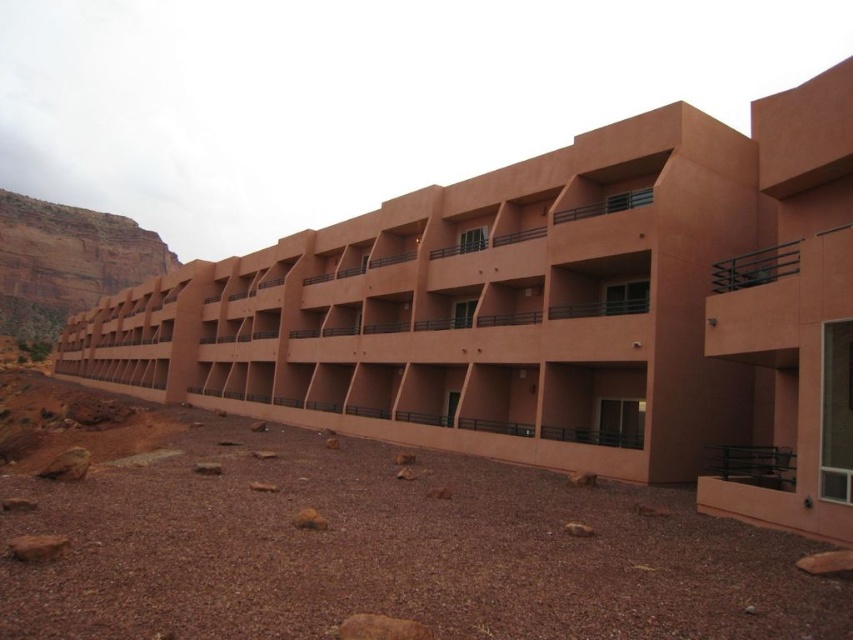
Question: Does matte orange building at center appear under rustic stone cliff at left?

Choices:
 (A) no
 (B) yes

Answer: (B)

Question: In this image, where is matte orange building at center located relative to rustic stone cliff at left?

Choices:
 (A) below
 (B) above

Answer: (A)

Question: Which point is closer to the camera?

Choices:
 (A) rustic stone cliff at left
 (B) matte orange building at center

Answer: (B)

Question: Can you confirm if matte orange building at center is positioned to the right of rustic stone cliff at left?

Choices:
 (A) no
 (B) yes

Answer: (B)